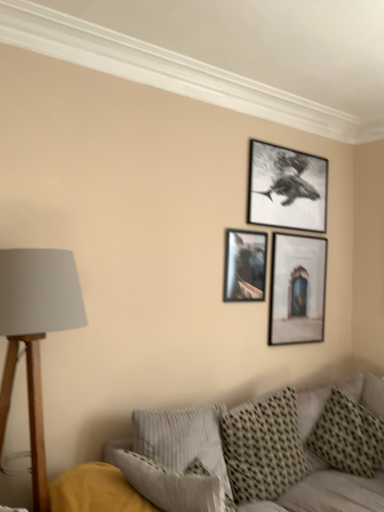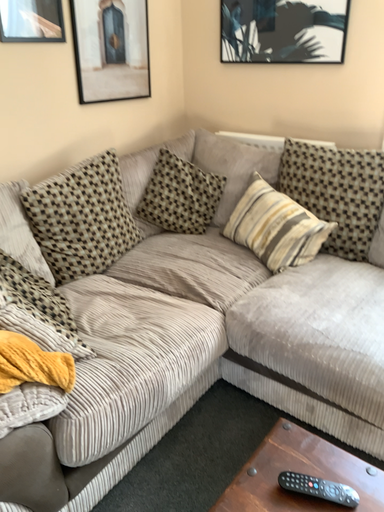
Question: How did the camera likely rotate when shooting the video?

Choices:
 (A) rotated upward
 (B) rotated downward

Answer: (B)